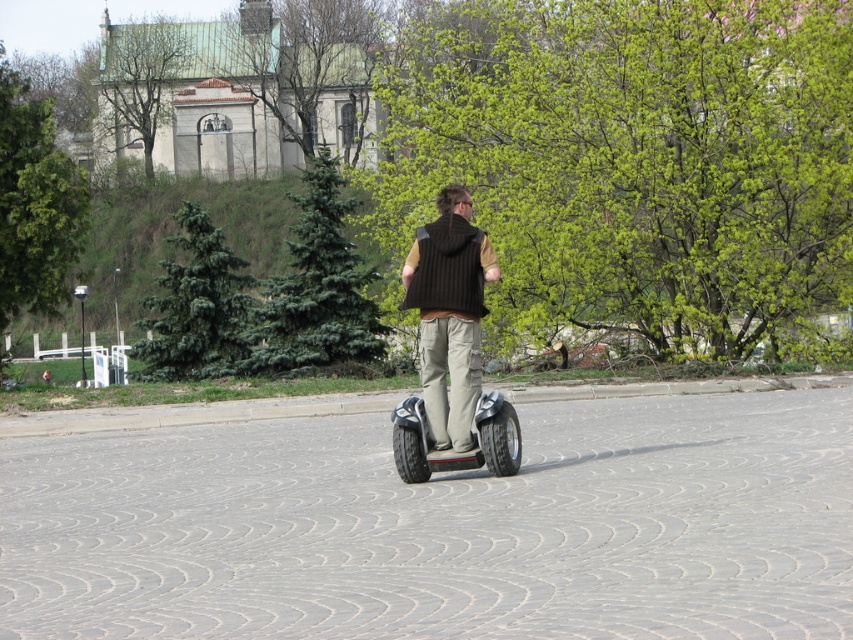
Question: Does knit brown vest at center have a lesser width compared to black rubber segway at center?

Choices:
 (A) no
 (B) yes

Answer: (B)

Question: Which object appears closest to the camera in this image?

Choices:
 (A) knit brown vest at center
 (B) black rubber segway at center

Answer: (A)

Question: Is knit brown vest at center to the left of black rubber segway at center from the viewer's perspective?

Choices:
 (A) no
 (B) yes

Answer: (B)

Question: Is knit brown vest at center in front of black rubber segway at center?

Choices:
 (A) no
 (B) yes

Answer: (B)